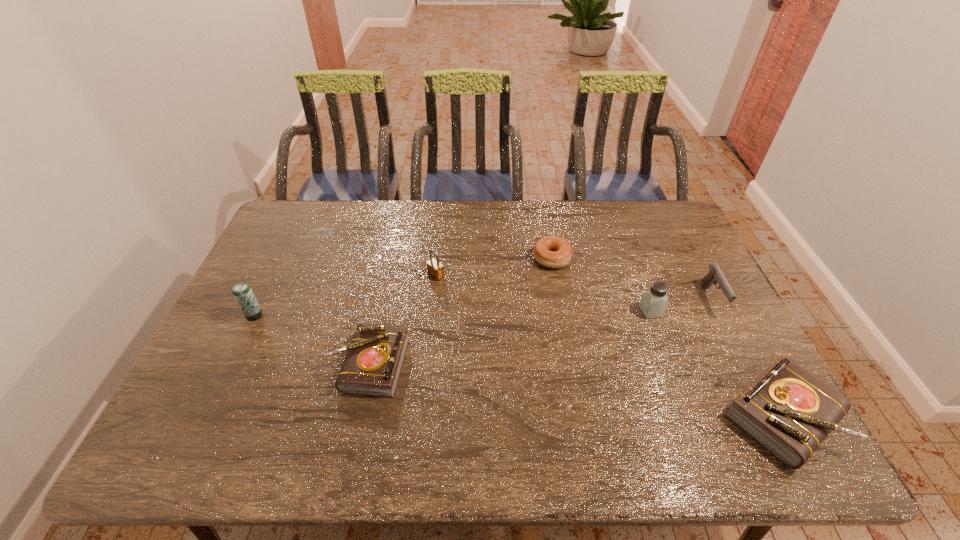
I want to click on object at the near right corner, so click(789, 411).

This screenshot has width=960, height=540. In the image, there is a desktop. In order to click on vacant space at the far edge in this screenshot , I will do `click(443, 204)`.

In the image, there is a desktop. Where is `free space at the near edge`? The image size is (960, 540). free space at the near edge is located at coordinates (489, 396).

In the image, there is a desktop. What are the coordinates of `vacant space at the left edge` in the screenshot? It's located at (264, 282).

The image size is (960, 540). What are the coordinates of `blank space at the right edge of the desktop` in the screenshot? It's located at (690, 265).

Find the location of a particular element. This screenshot has width=960, height=540. vacant space at the far left corner of the desktop is located at coordinates (289, 205).

In the image, there is a desktop. Where is `free region at the near left corner`? Image resolution: width=960 pixels, height=540 pixels. free region at the near left corner is located at coordinates (219, 394).

This screenshot has width=960, height=540. In the image, there is a desktop. Identify the location of vacant space at the far right corner. (668, 228).

You are a GUI agent. You are given a task and a screenshot of the screen. Output one action in this format:
    pyautogui.click(x=<x>, y=<y>)
    Task: Click on the vacant point located between the right diary and the leftmost object
    The height and width of the screenshot is (540, 960).
    Given the screenshot: What is the action you would take?
    pyautogui.click(x=518, y=366)

Locate an element on the screen. This screenshot has width=960, height=540. vacant space that's between the padlock and the third object from right to left is located at coordinates (543, 293).